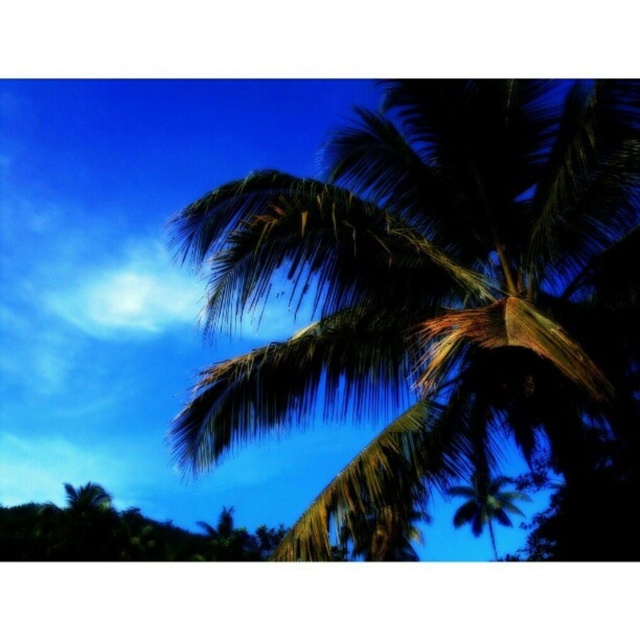
Question: Among these objects, which one is nearest to the camera?

Choices:
 (A) green leafy palm tree at center
 (B) dark green leafy coconut tree at upper right

Answer: (B)

Question: Which point is farther from the camera taking this photo?

Choices:
 (A) (476, 484)
 (B) (257, 298)

Answer: (A)

Question: Is dark green leafy coconut tree at upper right above green leafy palm tree at center?

Choices:
 (A) yes
 (B) no

Answer: (A)

Question: Where is dark green leafy coconut tree at upper right located in relation to green leafy palm tree at center in the image?

Choices:
 (A) left
 (B) right

Answer: (A)

Question: Does dark green leafy coconut tree at upper right appear under green leafy palm tree at center?

Choices:
 (A) yes
 (B) no

Answer: (B)